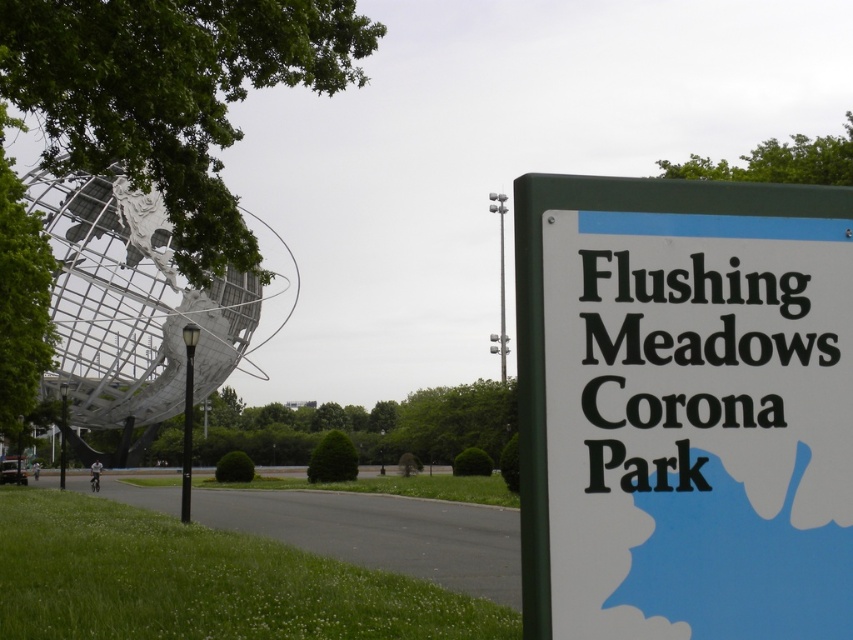
Can you confirm if white plastic sign at right is smaller than metallic globe at left?

Yes.

Is point (706, 275) positioned in front of point (122, 204)?

Yes, it is.

Find the location of a particular element. This screenshot has width=853, height=640. white plastic sign at right is located at coordinates (683, 408).